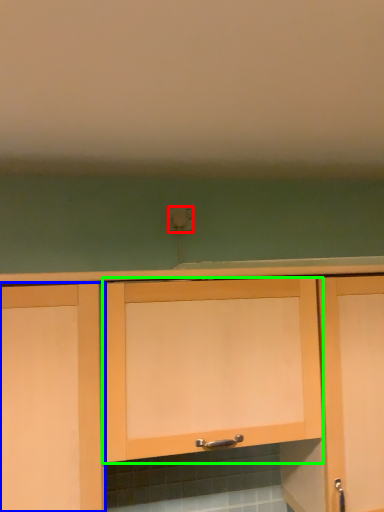
Question: Based on their relative distances, which object is farther from electric outlet (highlighted by a red box)? Choose from cabinetry (highlighted by a blue box) and cabinetry (highlighted by a green box).

Choices:
 (A) cabinetry
 (B) cabinetry

Answer: (A)